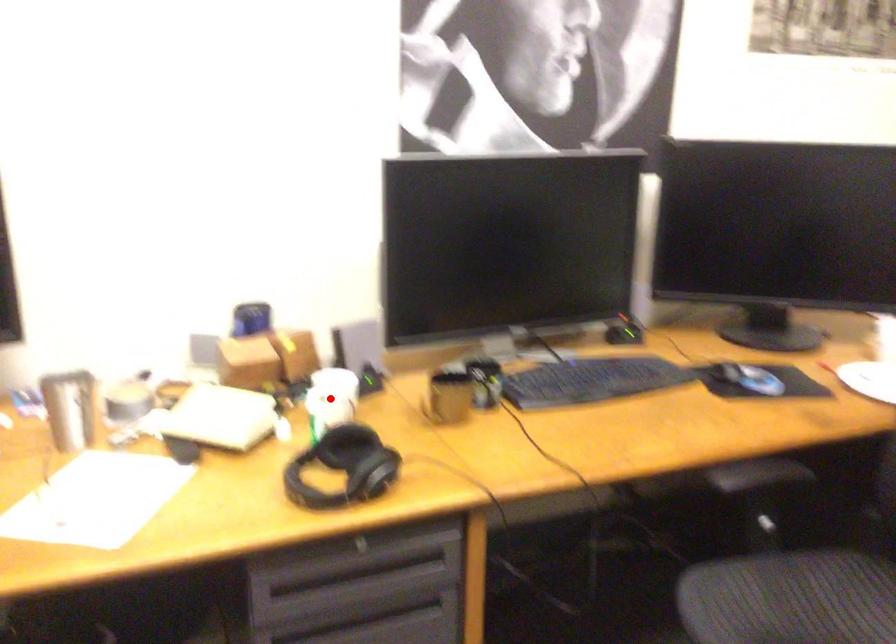
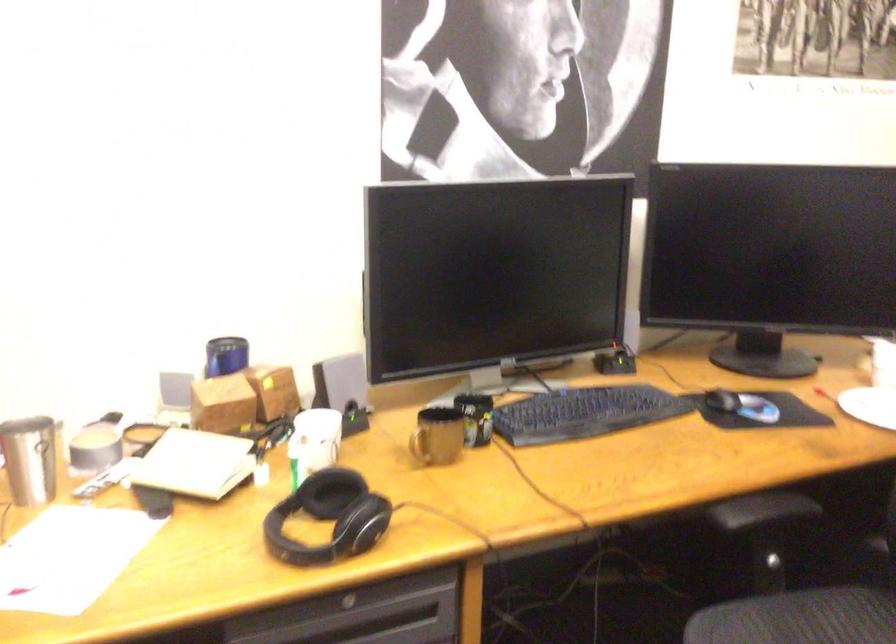
Locate, in the second image, the point that corresponds to the highlighted location in the first image.

(314, 440)